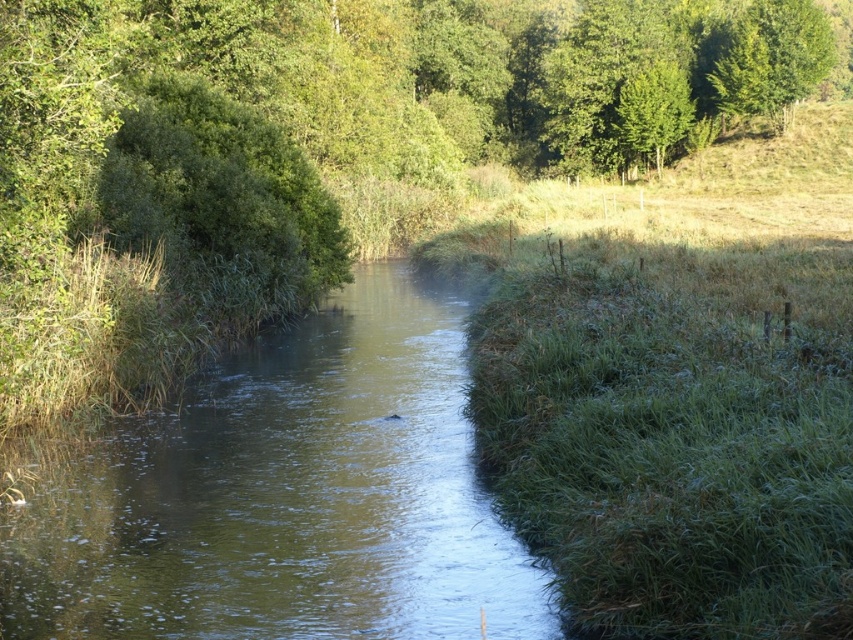
Who is more distant from viewer, [569,563] or [357,314]?

Positioned behind is point [357,314].

Measure the distance between green grassy bank at center-right and green grassy stream at center.

They are 3.32 meters apart.

Is point (519, 294) positioned behind point (280, 353)?

No, it is in front of (280, 353).

Find the location of `green grassy bank at center-right`. green grassy bank at center-right is located at coordinates (666, 426).